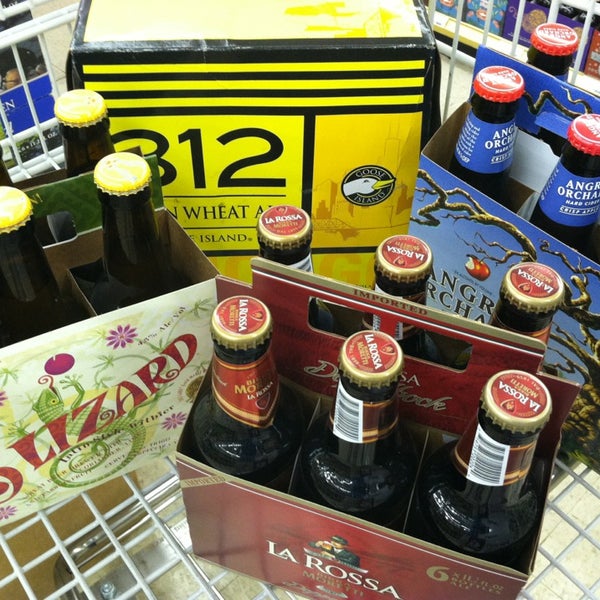
Image resolution: width=600 pixels, height=600 pixels. Identify the location of floor. [x=155, y=475].